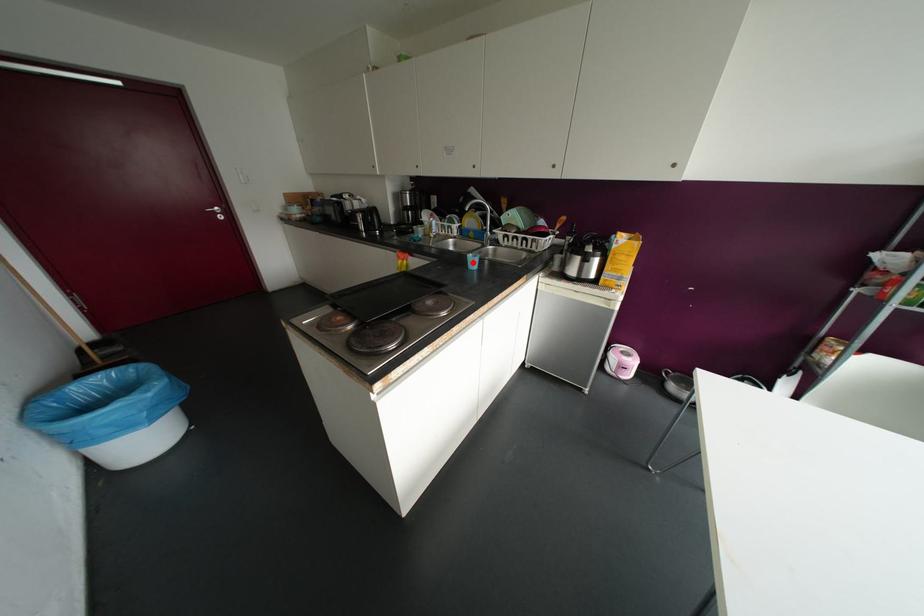
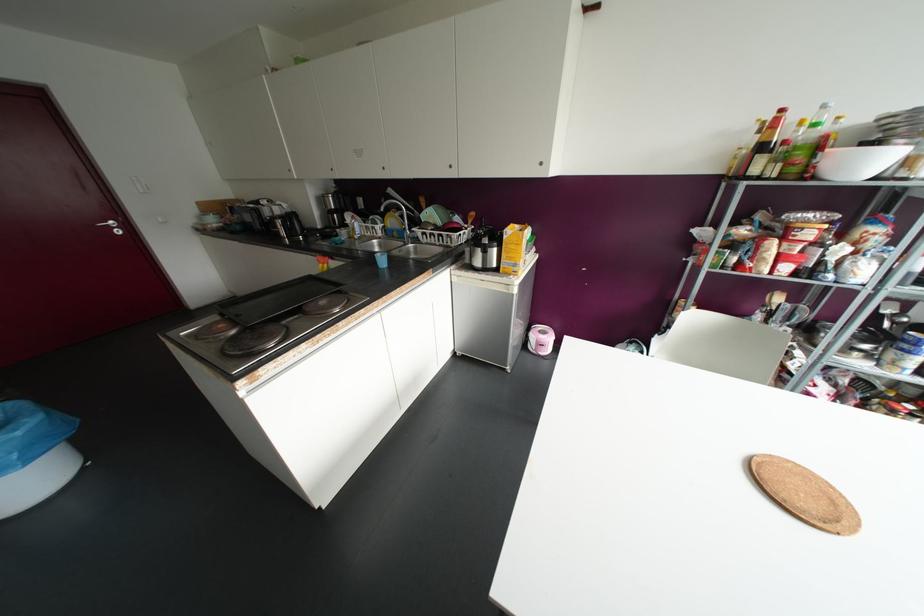
Question: A red point is marked in image1. In image2, is the corresponding 3D point closer to the camera or farther? Reply with the corresponding letter.

Choices:
 (A) The corresponding 3D point is closer.
 (B) The corresponding 3D point is farther.

Answer: (A)